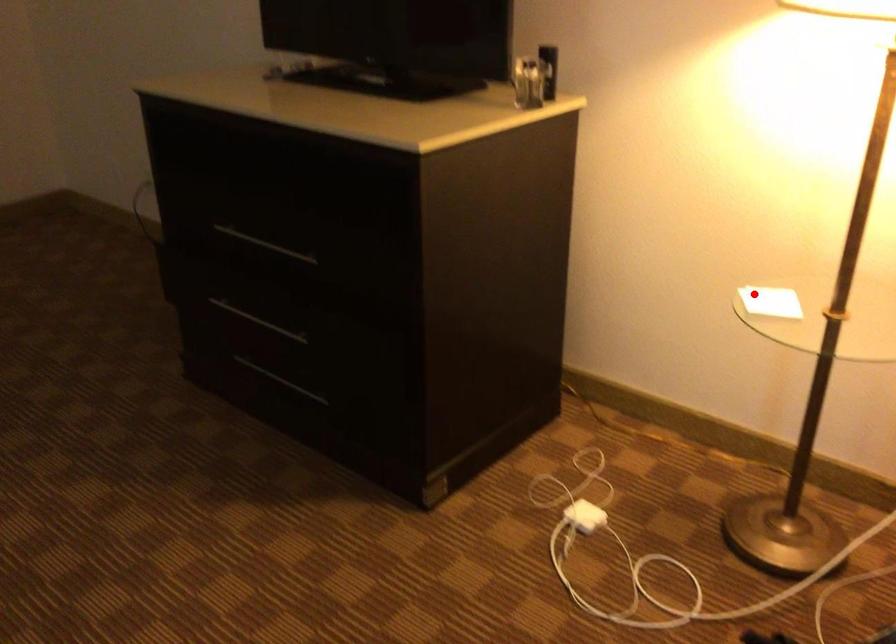
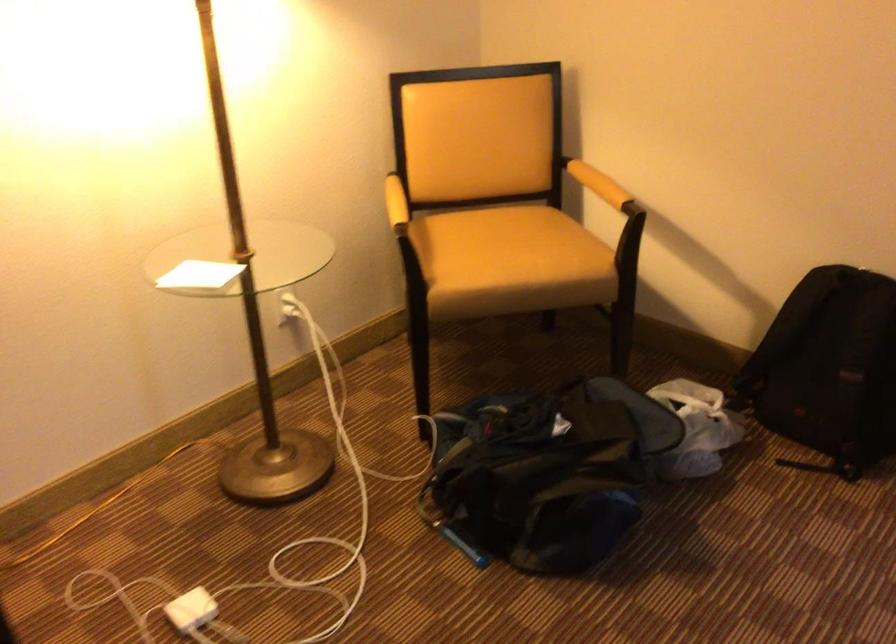
Question: I am providing you with two images of the same scene from different viewpoints. A red point is marked on the first image. Can you still see the location of the red point in image 2?

Choices:
 (A) Yes
 (B) No

Answer: (A)